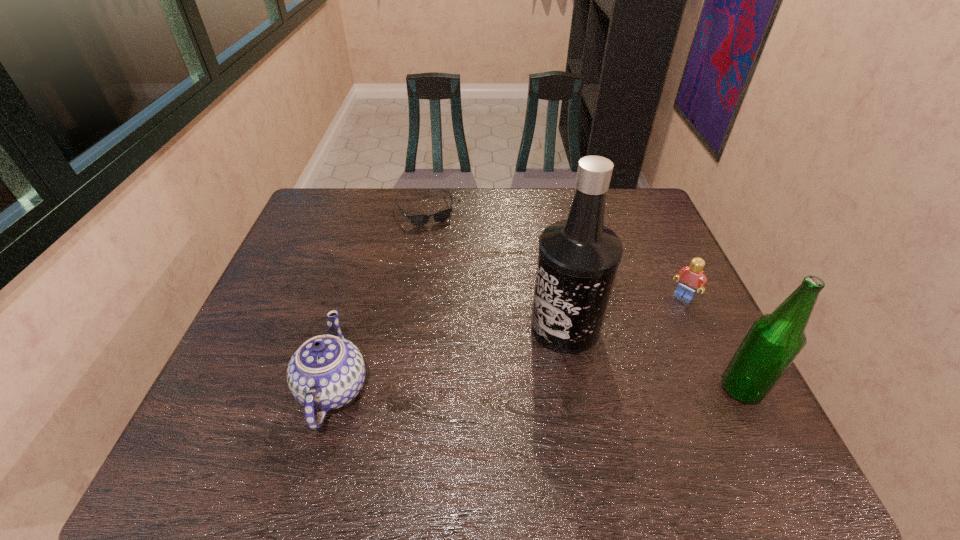
Identify the location of free space that is in between the third object from right to left and the second tallest object. The width and height of the screenshot is (960, 540). (653, 358).

Where is `free space between the liquor and the second tallest object`? The width and height of the screenshot is (960, 540). free space between the liquor and the second tallest object is located at coordinates (653, 358).

Where is `free spot between the third tallest object and the shortest object`? This screenshot has width=960, height=540. free spot between the third tallest object and the shortest object is located at coordinates (379, 300).

Find the location of `free area in between the fourth tallest object and the fourth shortest object`. free area in between the fourth tallest object and the fourth shortest object is located at coordinates (712, 342).

Where is `vacant space in between the Lego and the third shortest object`? The height and width of the screenshot is (540, 960). vacant space in between the Lego and the third shortest object is located at coordinates (509, 343).

I want to click on vacant space that is in between the third object from left to right and the farthest object, so click(x=494, y=269).

In order to click on vacant region between the tallest object and the second shortest object in this screenshot , I will do `click(624, 312)`.

Select which object is the second closest to the fourth tallest object. Please provide its 2D coordinates. Your answer should be formatted as a tuple, i.e. [(x, y)], where the tuple contains the x and y coordinates of a point satisfying the conditions above.

[(578, 259)]

Locate an element on the screen. This screenshot has height=540, width=960. object that stands as the second closest to the beer bottle is located at coordinates (578, 259).

You are a GUI agent. You are given a task and a screenshot of the screen. Output one action in this format:
    pyautogui.click(x=<x>, y=<y>)
    Task: Click on the free space in the image that satisfies the following two spatial constraints: 1. on the front side of the second tallest object; 2. on the label of the third object from left to right
    
    Given the screenshot: What is the action you would take?
    pyautogui.click(x=576, y=389)